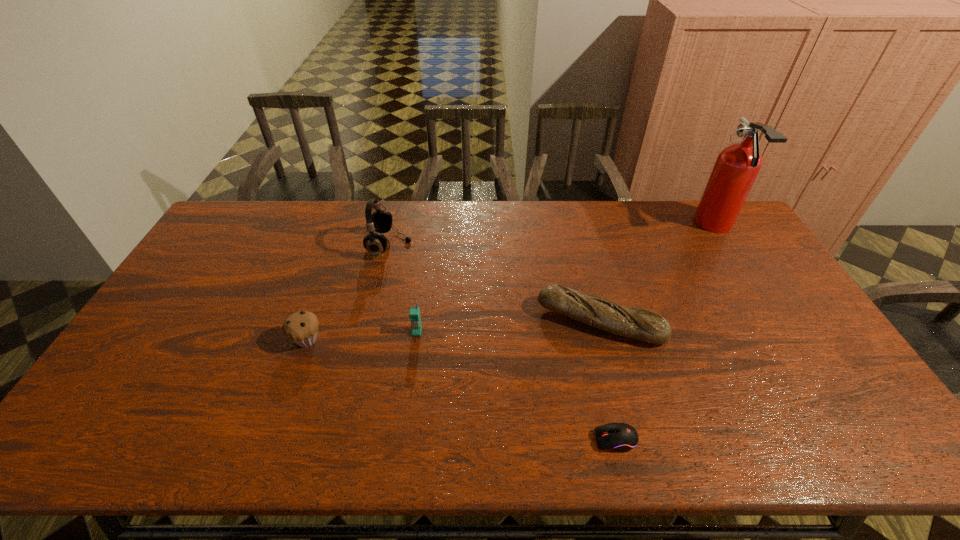
Find the location of a particular element. The image size is (960, 540). object situated at the far right corner is located at coordinates (737, 166).

Locate an element on the screen. The width and height of the screenshot is (960, 540). vacant point at the far edge is located at coordinates (401, 224).

Identify the location of vacant space at the near edge of the desktop. The width and height of the screenshot is (960, 540). (541, 435).

Identify the location of vacant space at the left edge of the desktop. The image size is (960, 540). (132, 367).

The height and width of the screenshot is (540, 960). Identify the location of free region at the right edge of the desktop. (807, 401).

Locate an element on the screen. The height and width of the screenshot is (540, 960). free space at the far left corner is located at coordinates (258, 202).

Locate an element on the screen. The image size is (960, 540). blank area at the far right corner is located at coordinates (691, 209).

You are a GUI agent. You are given a task and a screenshot of the screen. Output one action in this format:
    pyautogui.click(x=<x>, y=<y>)
    Task: Click on the free space between the headset and the third object from left to right
    This screenshot has width=960, height=540.
    Given the screenshot: What is the action you would take?
    pyautogui.click(x=403, y=288)

The width and height of the screenshot is (960, 540). I want to click on vacant region between the baguet and the muffin, so click(454, 330).

The width and height of the screenshot is (960, 540). I want to click on vacant space that's between the third tallest object and the rightmost object, so click(565, 279).